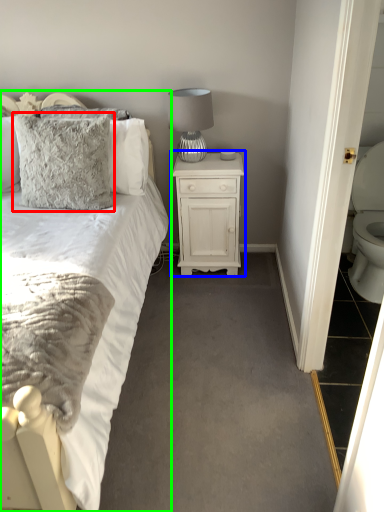
Question: Based on their relative distances, which object is farther from pillow (highlighted by a red box)? Choose from nightstand (highlighted by a blue box) and bed (highlighted by a green box).

Choices:
 (A) nightstand
 (B) bed

Answer: (A)